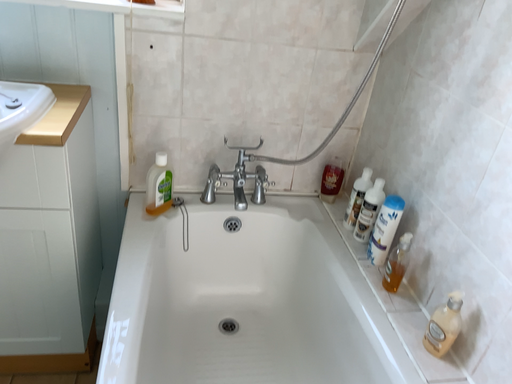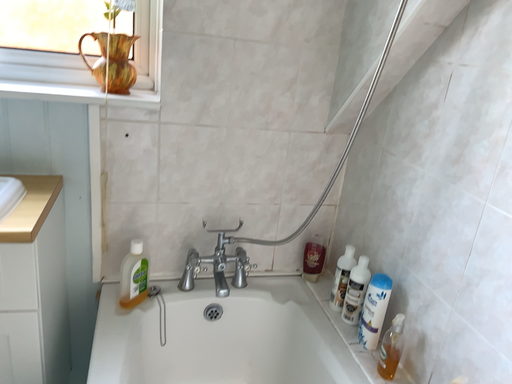
Question: How did the camera likely rotate when shooting the video?

Choices:
 (A) rotated downward
 (B) rotated upward

Answer: (B)